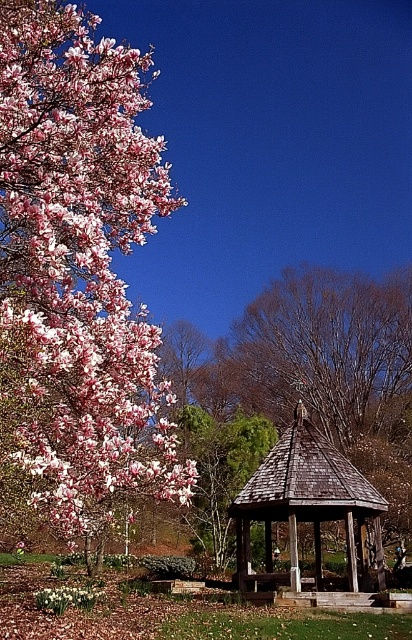
You are a gardener planning to install a new pathway leading from the wooden gazebo at center to the pink matte flower at upper left. Based on their positions, which direction should the pathway head?

The pathway should head to the left since the pink matte flower at upper left is positioned on the left side of the wooden gazebo at center.

In the scene shown: You are standing in the outdoor scene and want to walk from the point at coordinates point (x=130, y=365) to the point at coordinates point (x=266, y=456). Which direction should you move to get closer to your destination?

Since point (x=130, y=365) is in front of point (x=266, y=456), you should move backward to reach your destination.

You are standing in the garden and want to take a photo of the pink matte flower at upper left and the wooden gazebo at center. Which object is closer to the camera?

The pink matte flower at upper left is positioned over the wooden gazebo at center, so it is closer to the camera.